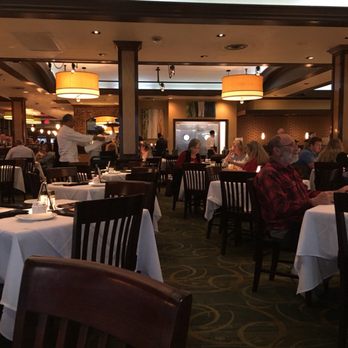
The image size is (348, 348). Identify the location of wall. (256, 128), (78, 116).